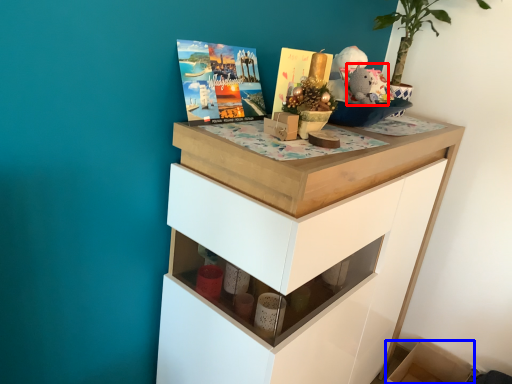
Question: Which object is closer to the camera taking this photo, animal (highlighted by a red box) or cabinetry (highlighted by a blue box)?

Choices:
 (A) animal
 (B) cabinetry

Answer: (A)